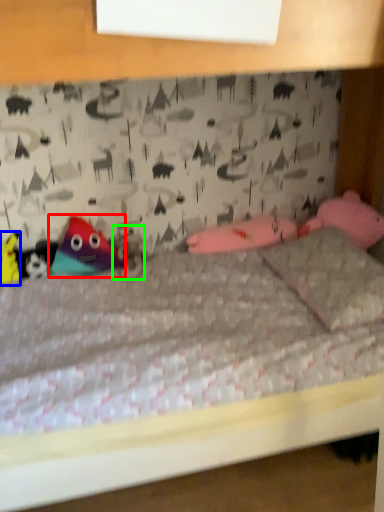
Question: Which object is positioned farthest from toy (highlighted by a red box)? Select from toy (highlighted by a blue box) and animal (highlighted by a green box).

Choices:
 (A) toy
 (B) animal

Answer: (A)